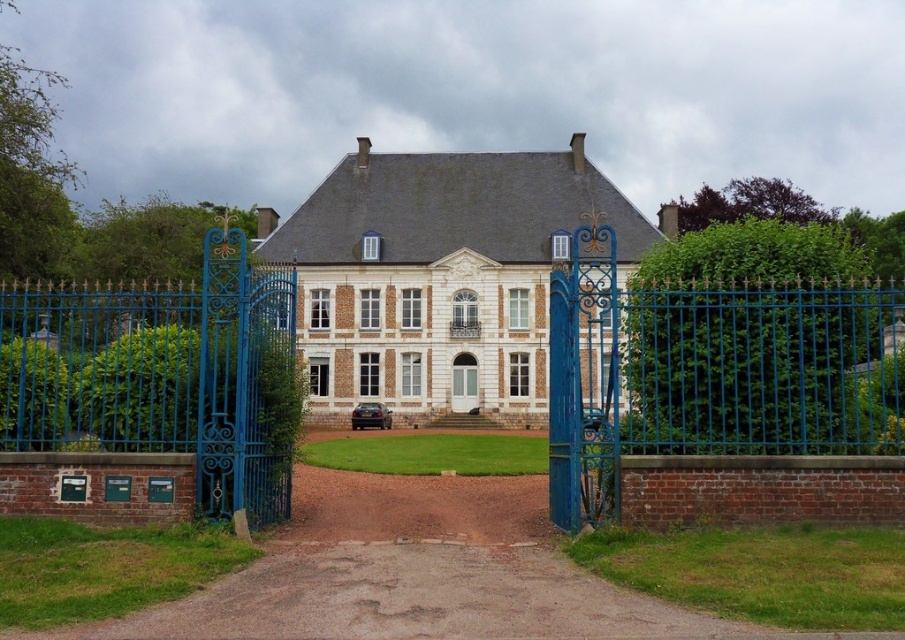
Question: Which of these objects is positioned farthest from the white brick mansion at center?

Choices:
 (A) blue wrought iron gate at center
 (B) white glossy door at center
 (C) blue wrought iron gate at left

Answer: (C)

Question: From the image, what is the correct spatial relationship of blue wrought iron gate at center in relation to matte white door at center?

Choices:
 (A) above
 (B) below

Answer: (A)

Question: Does blue wrought iron gate at left appear on the right side of white glossy door at center?

Choices:
 (A) yes
 (B) no

Answer: (B)

Question: Which point is closer to the camera?

Choices:
 (A) white brick mansion at center
 (B) matte white door at center
 (C) blue wrought iron gate at center

Answer: (C)

Question: Which object appears closest to the camera in this image?

Choices:
 (A) blue wrought iron gate at left
 (B) white glossy door at center
 (C) matte white door at center

Answer: (A)

Question: Is blue wrought iron gate at left positioned at the back of white glossy door at center?

Choices:
 (A) no
 (B) yes

Answer: (A)